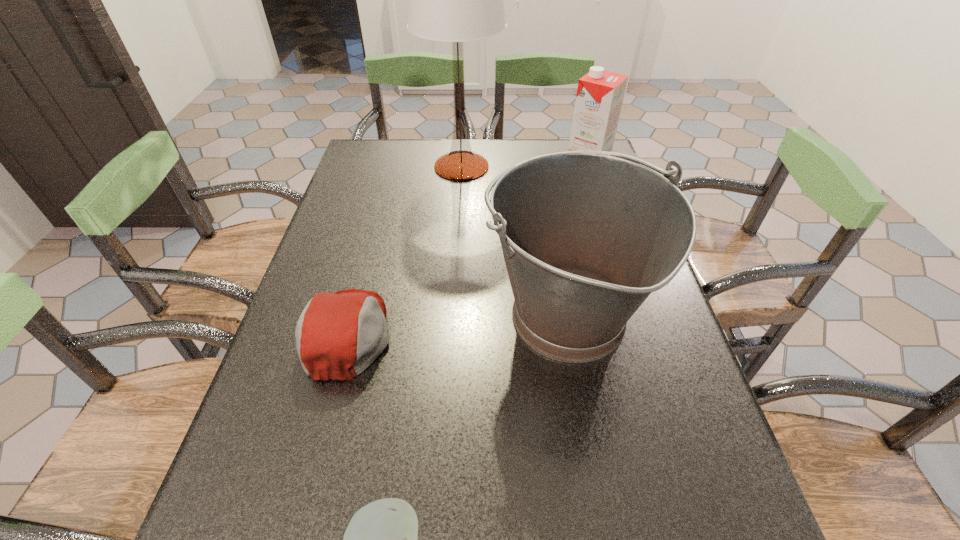
Where is `free space between the cap and the bucket`? This screenshot has width=960, height=540. free space between the cap and the bucket is located at coordinates (457, 327).

Identify which object is located as the third nearest to the bucket. Please provide its 2D coordinates. Your answer should be formatted as a tuple, i.e. [(x, y)], where the tuple contains the x and y coordinates of a point satisfying the conditions above.

[(457, 0)]

Identify which object is located as the nearest to the bucket. Please provide its 2D coordinates. Your answer should be formatted as a tuple, i.e. [(x, y)], where the tuple contains the x and y coordinates of a point satisfying the conditions above.

[(338, 335)]

Where is `free space that satisfies the following two spatial constraints: 1. above the cylindrical shade of the tallest object; 2. on the left side of the carton`? The height and width of the screenshot is (540, 960). free space that satisfies the following two spatial constraints: 1. above the cylindrical shade of the tallest object; 2. on the left side of the carton is located at coordinates (462, 171).

Where is `blank area in the image that satisfies the following two spatial constraints: 1. on the back side of the carton; 2. above the cylindrical shade of the table lamp`? This screenshot has height=540, width=960. blank area in the image that satisfies the following two spatial constraints: 1. on the back side of the carton; 2. above the cylindrical shade of the table lamp is located at coordinates (586, 167).

You are a GUI agent. You are given a task and a screenshot of the screen. Output one action in this format:
    pyautogui.click(x=<x>, y=<y>)
    Task: Click on the free space that satisfies the following two spatial constraints: 1. on the back side of the carton; 2. above the cylindrical shade of the table lamp
    Image resolution: width=960 pixels, height=540 pixels.
    Given the screenshot: What is the action you would take?
    tap(586, 167)

Locate an element on the screen. The image size is (960, 540). free spot that satisfies the following two spatial constraints: 1. on the front side of the bucket; 2. on the front-facing side of the cap is located at coordinates (568, 334).